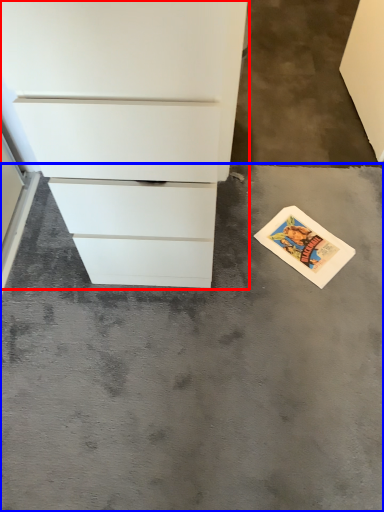
Question: Which object appears farthest to the camera in this image, chest of drawers (highlighted by a red box) or concrete (highlighted by a blue box)?

Choices:
 (A) chest of drawers
 (B) concrete

Answer: (B)